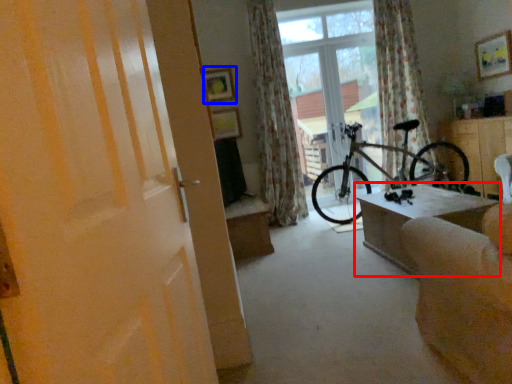
Question: Which of the following is the farthest to the observer, table (highlighted by a red box) or picture frame (highlighted by a blue box)?

Choices:
 (A) table
 (B) picture frame

Answer: (B)